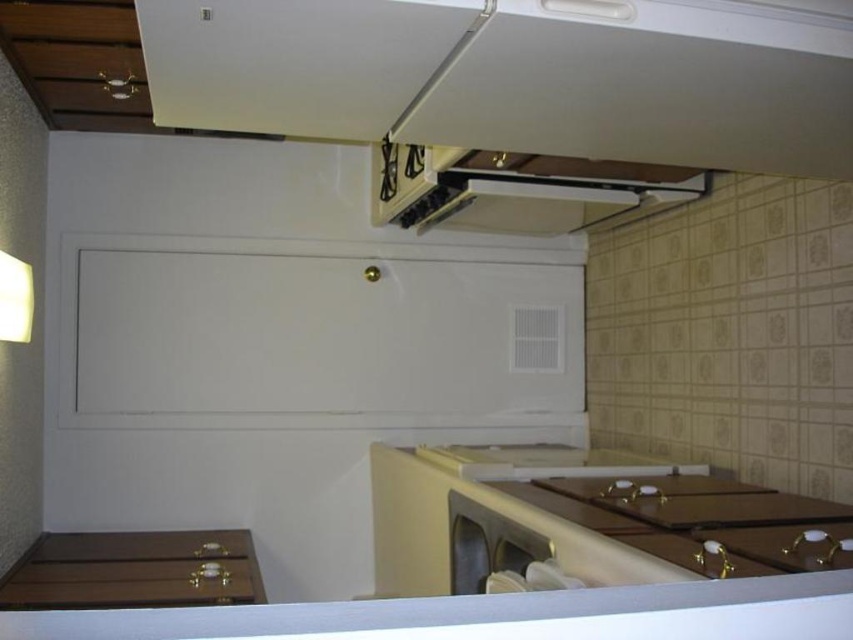
You are designing a kitchen layout and need to ensure that the white glossy exhaust hood at upper center and the satin silver dishwasher at lower center do not block each other. Based on their heights, which appliance should be placed higher up to avoid obstruction?

The white glossy exhaust hood at upper center should be placed higher up since it has a greater height compared to the satin silver dishwasher at lower center, which will help prevent obstruction between them.

You are designing a kitchen layout and need to place a new appliance between the white glossy exhaust hood at upper center and the satin silver dishwasher at lower center. Based on their widths, which appliance should you place closer to the left side of the kitchen to ensure proper alignment?

The white glossy exhaust hood at upper center might be wider than the satin silver dishwasher at lower center, so placing the wider exhaust hood closer to the left side would help align both appliances properly.

You are planning to install a new ventilation system in the kitchen and need to know the size of the white glossy exhaust hood at upper center compared to the satin silver dishwasher at lower center. Which one is larger?

Result: The white glossy exhaust hood at upper center is bigger than the satin silver dishwasher at lower center according to the description.